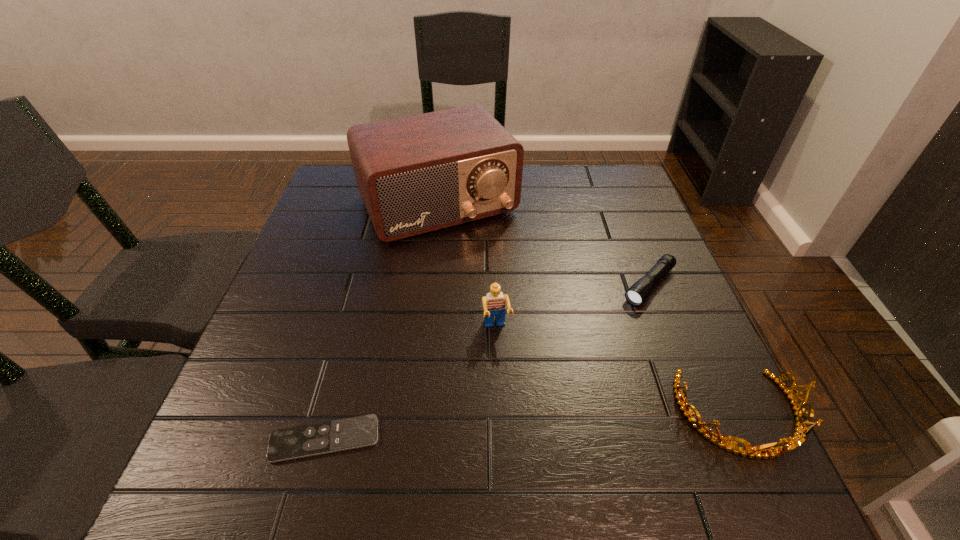
Where is `object that ranks as the third closest to the remote control`? This screenshot has height=540, width=960. object that ranks as the third closest to the remote control is located at coordinates (799, 437).

Choose which object is the nearest neighbor to the fourth shortest object. Please provide its 2D coordinates. Your answer should be formatted as a tuple, i.e. [(x, y)], where the tuple contains the x and y coordinates of a point satisfying the conditions above.

[(416, 174)]

Find the location of a particular element. free space that satisfies the following two spatial constraints: 1. on the front side of the Lego; 2. on the left side of the tallest object is located at coordinates (423, 329).

Locate an element on the screen. The image size is (960, 540). vacant space that satisfies the following two spatial constraints: 1. on the front side of the farthest object; 2. on the right side of the third farthest object is located at coordinates (423, 329).